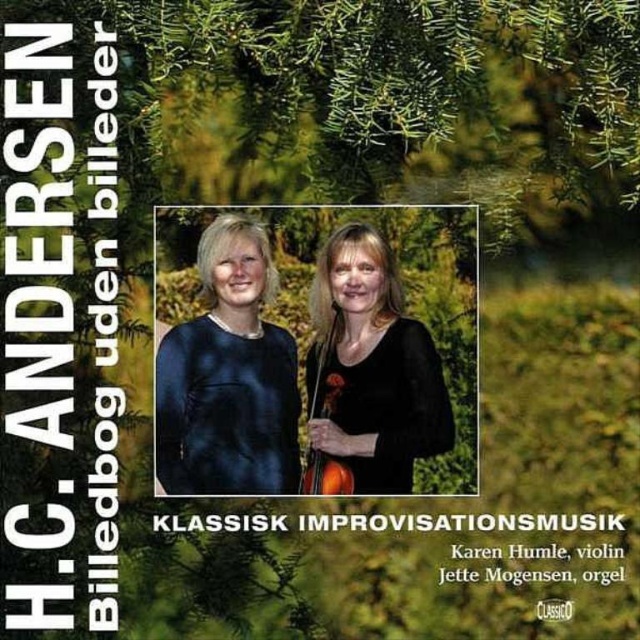
You are a photographer standing 1.5 meters away from the camera. You want to adjust the matte black dress at center so that it is closer to the camera. How much distance do you need to move it forward?

The matte black dress at center is currently 2.29 meters away from the camera. To move it closer so that it is 1.5 meters from the camera, you need to move it forward by 0.79 meters.